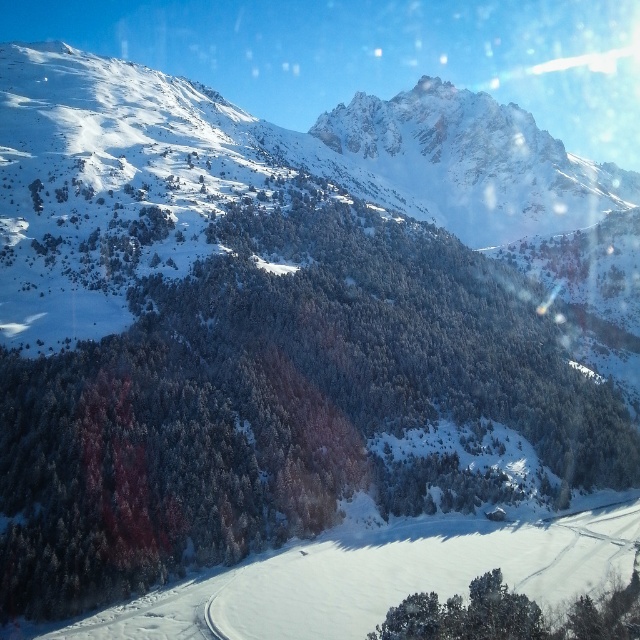
You are standing at the window and want to take a photo of the snowy rocky mountain at upper center. The camera has a zoom feature that can focus on coordinates between 0.2 and 0.3 on the x and y axes. Will the mountain be in the camera frame?

The snowy rocky mountain at upper center is at coordinates point (x=273, y=182). The camera can focus on coordinates between 0.2 and 0.3 on the x and y axes. Since the mountain is at 0.287 on the x axis which is within the range, but its y coordinate is 0.428 which is outside the camera frame. Therefore, the mountain will not be in the camera frame.

You are standing at the window overlooking the winter landscape. There is a green matte tree at center. Can you see any other objects at the coordinates point [280,403]?

The point [280,403] marks the green matte tree at center, so there are no other objects at that coordinate besides the green matte tree at center.

You are standing at the window and looking at the snowy rocky mountain at upper center. There is a point marked at coordinates (273, 182). What is the significance of this point in relation to the snowy rocky mountain at upper center?

The point marked at coordinates (273, 182) is located on the snowy rocky mountain at upper center.